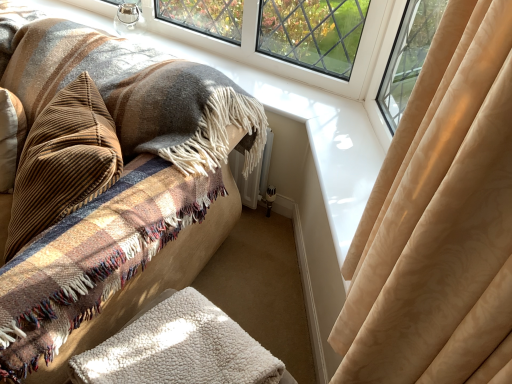
Question: Considering their positions, is white fluffy blanket at lower center located in front of or behind brown corduroy pillow at left?

Choices:
 (A) behind
 (B) front

Answer: (B)

Question: Considering the positions of point (230, 336) and point (78, 175), is point (230, 336) closer or farther from the camera than point (78, 175)?

Choices:
 (A) farther
 (B) closer

Answer: (B)

Question: Which object is the closest to the brown corduroy pillow at left?

Choices:
 (A) plush beige rug at lower center
 (B) white fluffy blanket at lower center

Answer: (A)

Question: Which is nearer to the brown corduroy pillow at left?

Choices:
 (A) white fluffy blanket at lower center
 (B) plush beige rug at lower center

Answer: (B)